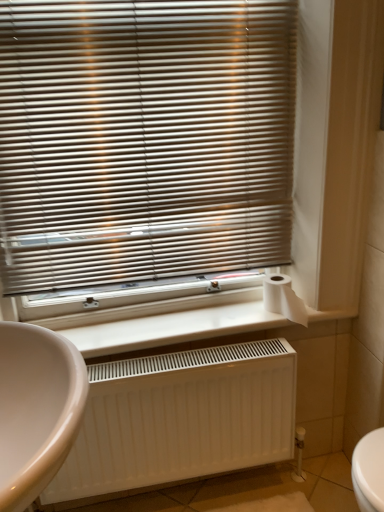
This screenshot has height=512, width=384. I want to click on vacant space to the left of white matte toilet paper at right, so click(237, 322).